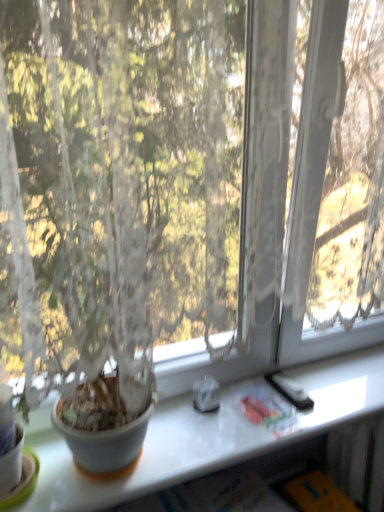
Locate an element on the screen. Image resolution: width=384 pixels, height=512 pixels. free space above white glossy table at lower center (from a real-world perspective) is located at coordinates (263, 407).